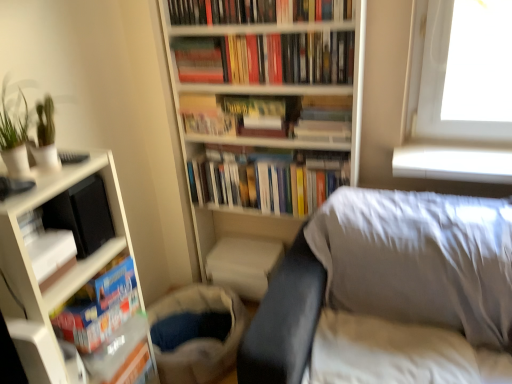
Question: In which direction should I rotate to look at hardcover books at center, acting as the 3th book starting from the top?

Choices:
 (A) left
 (B) right

Answer: (B)

Question: Can you confirm if textured fabric bag at lower center is shorter than white fabric sheet at lower right?

Choices:
 (A) yes
 (B) no

Answer: (B)

Question: From a real-world perspective, is textured fabric bag at lower center on white fabric sheet at lower right?

Choices:
 (A) yes
 (B) no

Answer: (B)

Question: Would you say textured fabric bag at lower center is outside white fabric sheet at lower right?

Choices:
 (A) yes
 (B) no

Answer: (A)

Question: Can you confirm if textured fabric bag at lower center is taller than white fabric sheet at lower right?

Choices:
 (A) no
 (B) yes

Answer: (B)

Question: From the image's perspective, is textured fabric bag at lower center over white fabric sheet at lower right?

Choices:
 (A) no
 (B) yes

Answer: (A)

Question: Is the position of textured fabric bag at lower center more distant than that of white fabric sheet at lower right?

Choices:
 (A) no
 (B) yes

Answer: (B)

Question: Does hardcover book at center, acting as the 4th book starting from the bottom, appear on the right side of matte brown book at center, which is the 1th paperback book from right to left?

Choices:
 (A) yes
 (B) no

Answer: (A)

Question: From a real-world perspective, is hardcover book at center, which is counted as the fourth book, starting from the top, located higher than matte brown book at center, which is the 1th paperback book from right to left?

Choices:
 (A) yes
 (B) no

Answer: (A)

Question: Is hardcover book at center, acting as the 4th book starting from the bottom, positioned with its back to matte brown book at center, which is counted as the 2th paperback book, starting from the left?

Choices:
 (A) no
 (B) yes

Answer: (A)

Question: Does hardcover book at center, acting as the 4th book starting from the bottom, have a lesser width compared to matte brown book at center, which is counted as the 2th paperback book, starting from the left?

Choices:
 (A) no
 (B) yes

Answer: (B)

Question: Is hardcover book at center, which is counted as the fourth book, starting from the top, wider than matte brown book at center, which is the 1th paperback book from right to left?

Choices:
 (A) no
 (B) yes

Answer: (A)

Question: Does hardcover book at center, which is counted as the fourth book, starting from the top, appear on the left side of matte brown book at center, which is the 1th paperback book from right to left?

Choices:
 (A) no
 (B) yes

Answer: (A)

Question: Can you confirm if hardcover book at center, which is counted as the second paperback book, starting from the right, is bigger than white matte bookcase at left, which appears as the 2th bookcase when viewed from the right?

Choices:
 (A) no
 (B) yes

Answer: (A)